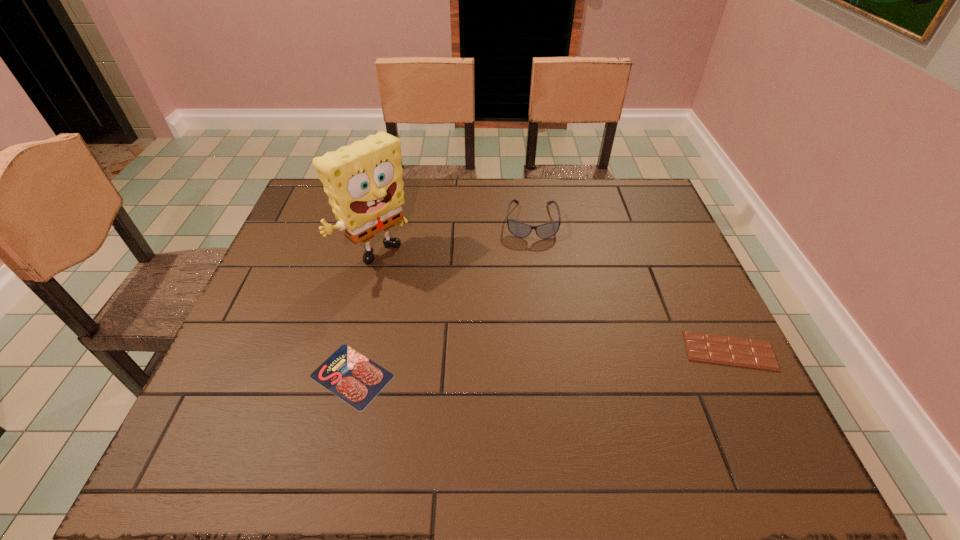
This screenshot has height=540, width=960. In order to click on salami in this screenshot , I will do `click(354, 378)`.

The image size is (960, 540). I want to click on chocolate bar, so click(x=726, y=350).

Locate an element on the screen. The image size is (960, 540). the third shortest object is located at coordinates (518, 229).

At what (x,y) coordinates should I click in order to perform the action: click on the third object from left to right. Please return your answer as a coordinate pair (x, y). The height and width of the screenshot is (540, 960). Looking at the image, I should click on (518, 229).

The width and height of the screenshot is (960, 540). I want to click on the tallest object, so click(x=364, y=183).

Locate an element on the screen. The width and height of the screenshot is (960, 540). vacant space located 0.210m on the back of the salami is located at coordinates (374, 279).

Locate an element on the screen. vacant space situated 0.380m on the left of the chocolate bar is located at coordinates (516, 351).

Locate an element on the screen. This screenshot has height=540, width=960. vacant space located 0.300m on the lenses of the second object from right to left is located at coordinates (536, 322).

You are a GUI agent. You are given a task and a screenshot of the screen. Output one action in this format:
    pyautogui.click(x=<x>, y=<y>)
    Task: Click on the free spot located 0.330m on the lenses of the second object from right to left
    The width and height of the screenshot is (960, 540).
    Given the screenshot: What is the action you would take?
    pyautogui.click(x=536, y=332)

At what (x,y) coordinates should I click in order to perform the action: click on free space located on the lenses of the second object from right to left. Please return your answer as a coordinate pair (x, y). This screenshot has height=540, width=960. Looking at the image, I should click on (536, 329).